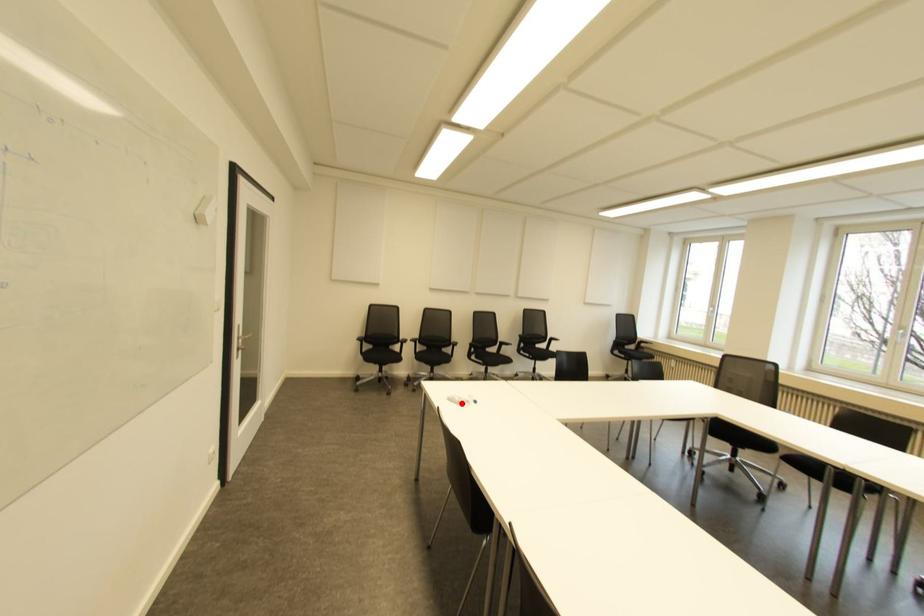
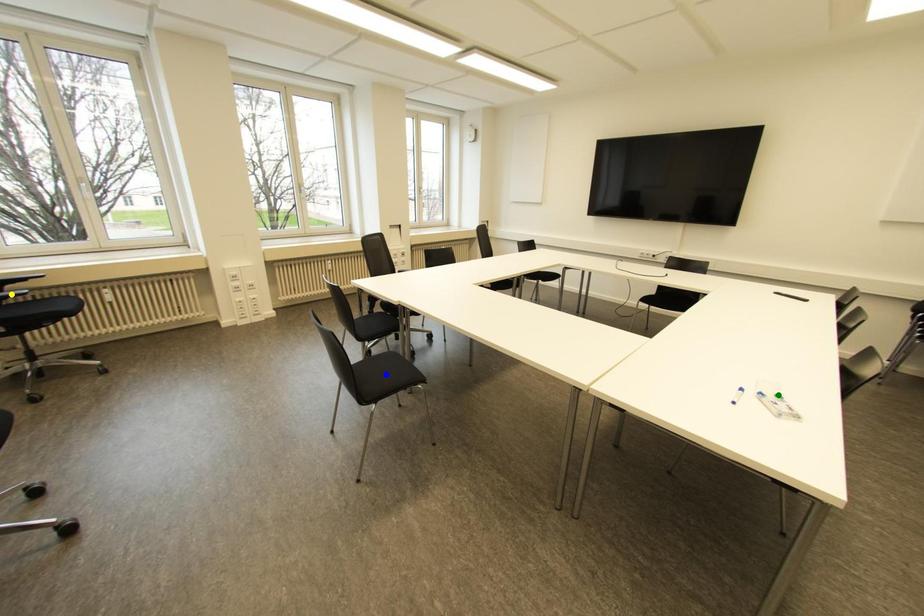
Question: I am providing you with two images of the same scene from different viewpoints. A red point is marked on the first image. You are given multiple points on the second image. Which point in image 2 represents the same 3d spot as the red point in image 1?

Choices:
 (A) blue point
 (B) yellow point
 (C) green point

Answer: (C)